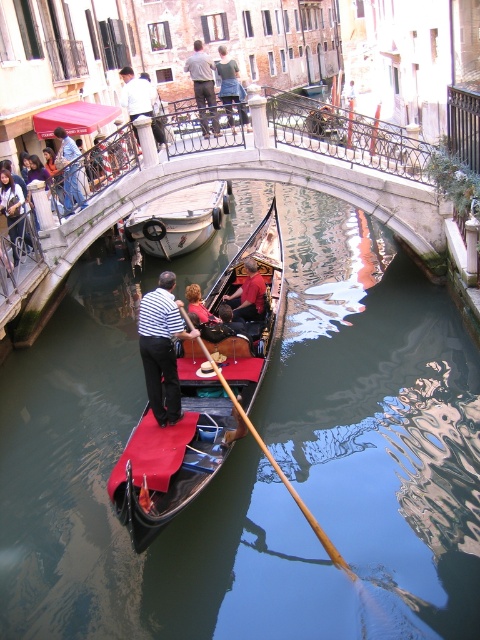
Question: Does black polished gondola at center have a lesser width compared to brown wood paddle at center?

Choices:
 (A) no
 (B) yes

Answer: (A)

Question: Estimate the real-world distances between objects in this image. Which object is farther from the blue denim jeans at upper center?

Choices:
 (A) striped fabric shirt at center
 (B) light gray fabric pants at center
 (C) white shirt at upper center

Answer: (A)

Question: Which object is closer to the camera taking this photo?

Choices:
 (A) black polished gondola at center
 (B) smooth dark water at center
 (C) blue denim jeans at upper center
 (D) red velvet cushion at center

Answer: (B)

Question: Estimate the real-world distances between objects in this image. Which object is farther from the white shirt at upper center?

Choices:
 (A) red velvet cushion at center
 (B) blue denim jeans at upper center
 (C) striped fabric shirt at center
 (D) silver metallic boat at center

Answer: (C)

Question: Does white shirt at upper center come behind dark blue jeans at left?

Choices:
 (A) yes
 (B) no

Answer: (B)

Question: From the image, what is the correct spatial relationship of brown wood paddle at center in relation to blue denim jeans at upper center?

Choices:
 (A) right
 (B) left

Answer: (A)